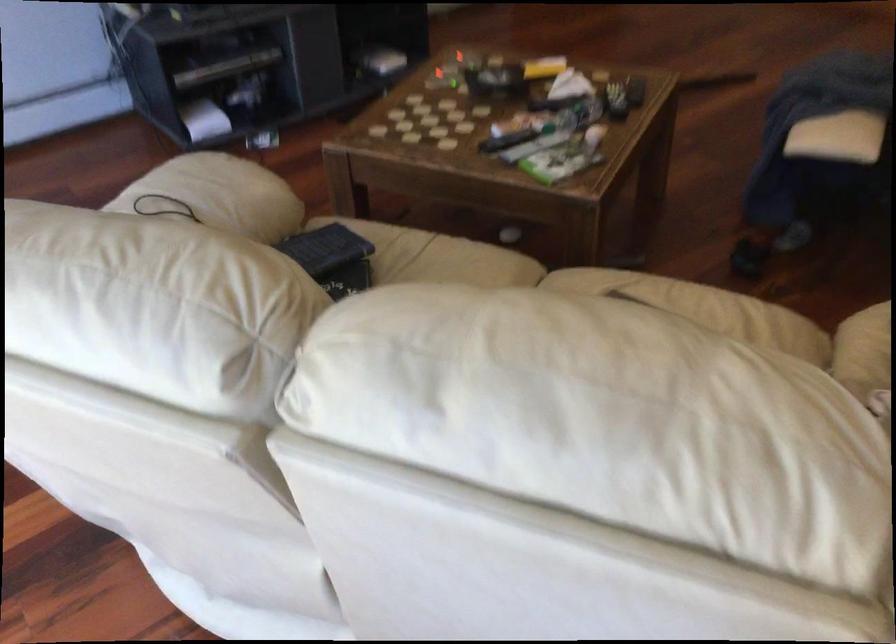
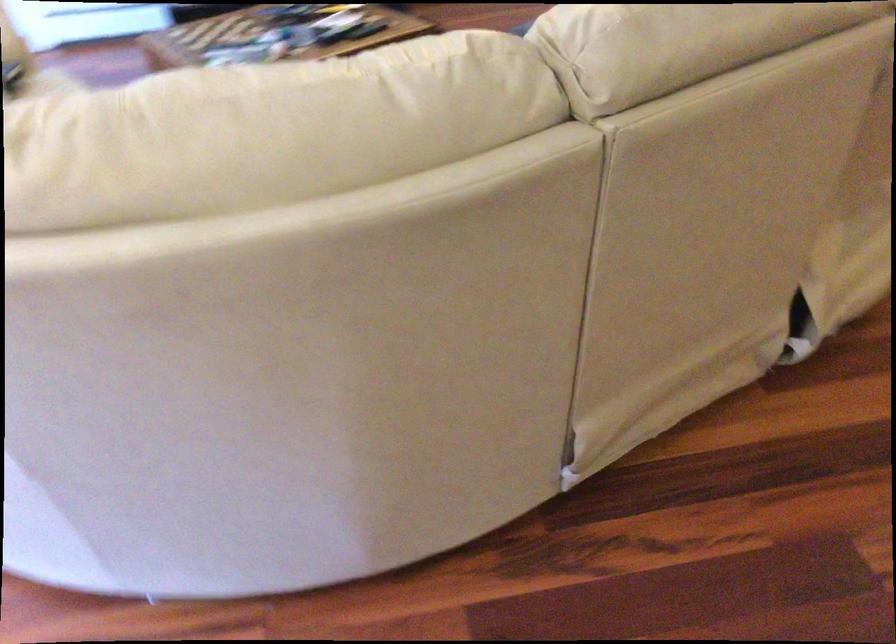
Question: In a continuous first-person perspective shot, in which direction is the camera moving?

Choices:
 (A) Left
 (B) Right
 (C) Forward
 (D) Backward

Answer: (B)